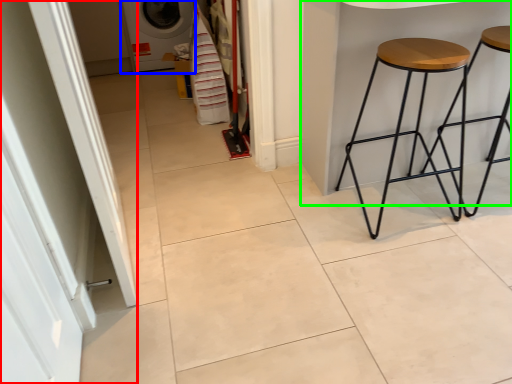
Question: Which object is the farthest from screen door (highlighted by a red box)? Choose among these: washing machine (highlighted by a blue box) or table (highlighted by a green box).

Choices:
 (A) washing machine
 (B) table

Answer: (A)